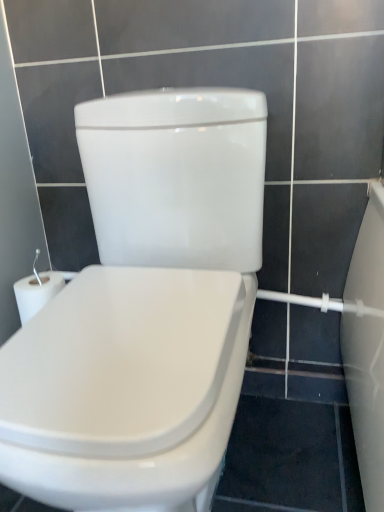
Question: Should I look upward or downward to see white glossy bidet at center?

Choices:
 (A) up
 (B) down

Answer: (B)